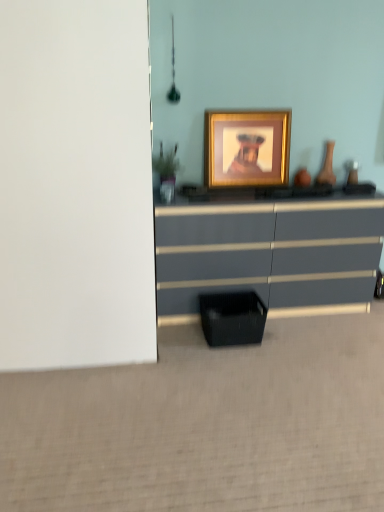
Question: Can you confirm if black mesh basket at lower center is thinner than green matte plant at left?

Choices:
 (A) no
 (B) yes

Answer: (A)

Question: Considering the relative sizes of black mesh basket at lower center and green matte plant at left in the image provided, is black mesh basket at lower center wider than green matte plant at left?

Choices:
 (A) yes
 (B) no

Answer: (A)

Question: From a real-world perspective, is black mesh basket at lower center located beneath green matte plant at left?

Choices:
 (A) no
 (B) yes

Answer: (B)

Question: Would you say black mesh basket at lower center is a long distance from green matte plant at left?

Choices:
 (A) no
 (B) yes

Answer: (A)

Question: Would you say black mesh basket at lower center contains green matte plant at left?

Choices:
 (A) yes
 (B) no

Answer: (B)

Question: Does point (246, 115) appear closer or farther from the camera than point (360, 243)?

Choices:
 (A) farther
 (B) closer

Answer: (A)

Question: Is gold/glossy picture frame at center in front of or behind matte gray chest of drawers at center in the image?

Choices:
 (A) behind
 (B) front

Answer: (A)

Question: In terms of height, does gold/glossy picture frame at center look taller or shorter compared to matte gray chest of drawers at center?

Choices:
 (A) short
 (B) tall

Answer: (A)

Question: In terms of width, does gold/glossy picture frame at center look wider or thinner when compared to matte gray chest of drawers at center?

Choices:
 (A) wide
 (B) thin

Answer: (B)

Question: From a real-world perspective, is gold/glossy picture frame at center above or below matte brown vase at right?

Choices:
 (A) above
 (B) below

Answer: (A)

Question: Based on their sizes in the image, would you say gold/glossy picture frame at center is bigger or smaller than matte brown vase at right?

Choices:
 (A) big
 (B) small

Answer: (A)

Question: From the image's perspective, is gold/glossy picture frame at center located above or below matte brown vase at right?

Choices:
 (A) above
 (B) below

Answer: (A)

Question: In the image, is gold/glossy picture frame at center positioned in front of or behind matte brown vase at right?

Choices:
 (A) behind
 (B) front

Answer: (B)

Question: Considering their positions, is green matte plant at left located in front of or behind matte brown vase at right?

Choices:
 (A) behind
 (B) front

Answer: (B)

Question: Visually, is green matte plant at left positioned to the left or to the right of matte brown vase at right?

Choices:
 (A) right
 (B) left

Answer: (B)